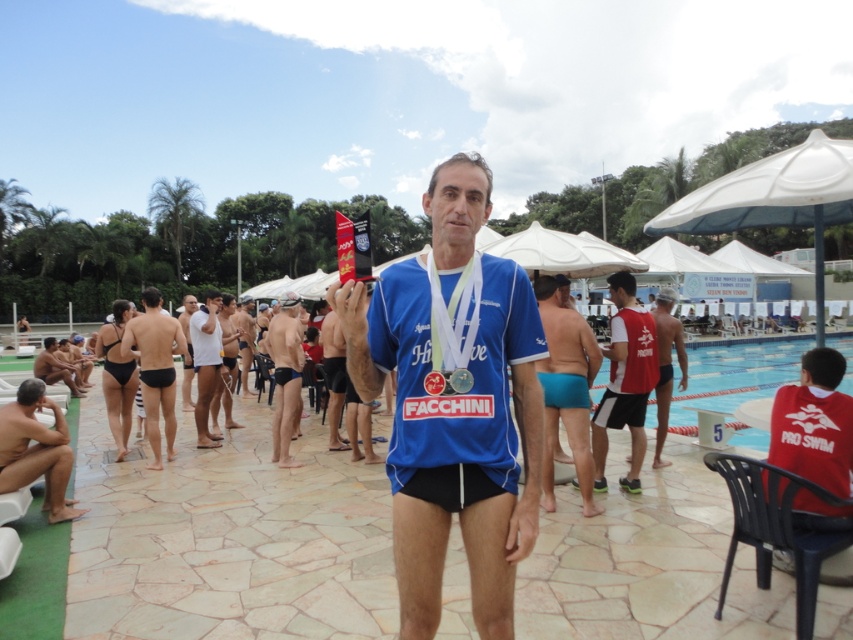
You are a photographer positioned at the center of the pool area. You need to capture a photo of the blue fabric shirt at center. According to the coordinates provided in the description, in which direction should you move to frame the shirt properly?

The blue fabric shirt at center is located at point (454, 403). Since the photographer is at the center, which is typically coordinate (426, 320), moving towards the direction of higher x and y coordinates would position the shirt in the frame. Therefore, move slightly to the right and upwards to align with the shirt at (454, 403).

You are a photographer at the poolside event and need to capture a photo where both the turquoise matte swim trunks at center and the matte black swim trunks at lower left are visible. Since the camera has a fixed focus, which swim trunks should be placed closer to the lens to ensure both are in focus?

The turquoise matte swim trunks at center should be placed closer to the lens because they are taller than the matte black swim trunks at lower left. This way, the height difference will help both appear in focus within the camera frame.

You are a photographer at the poolside event and want to capture a shot of the nude skin at lower left and the matte blue swim trunks at center. Based on their positions, which object is closer to the left side of the frame?

The nude skin at lower left is closer to the left side of the frame since it is positioned to the left of the matte blue swim trunks at center.